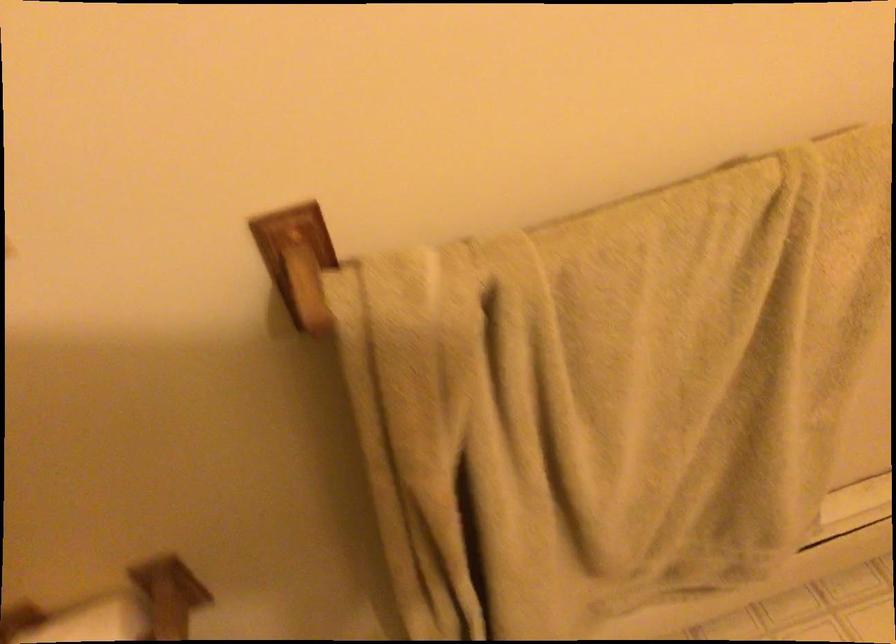
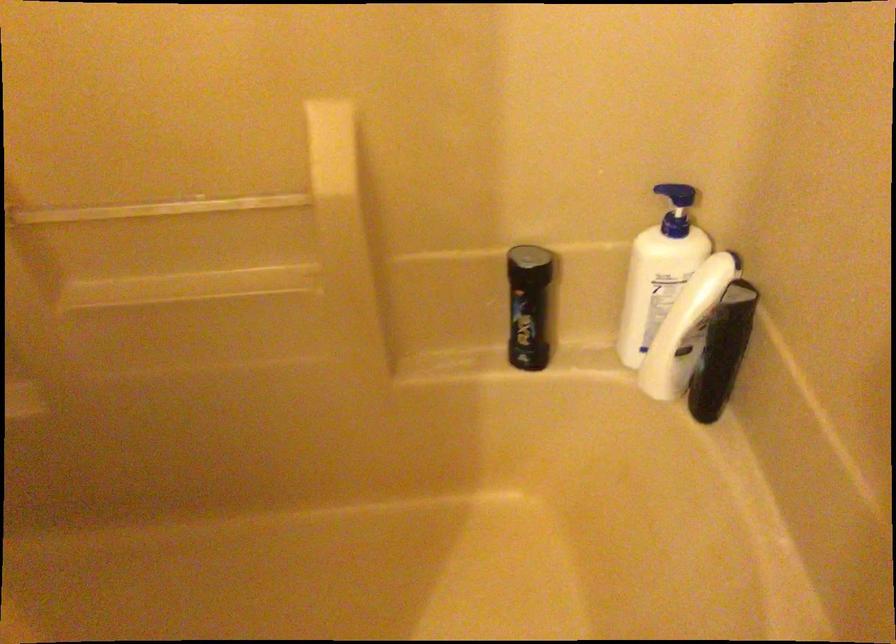
The first image is from the beginning of the video and the second image is from the end. How did the camera likely rotate when shooting the video?

The rotation direction of the camera is left-down.